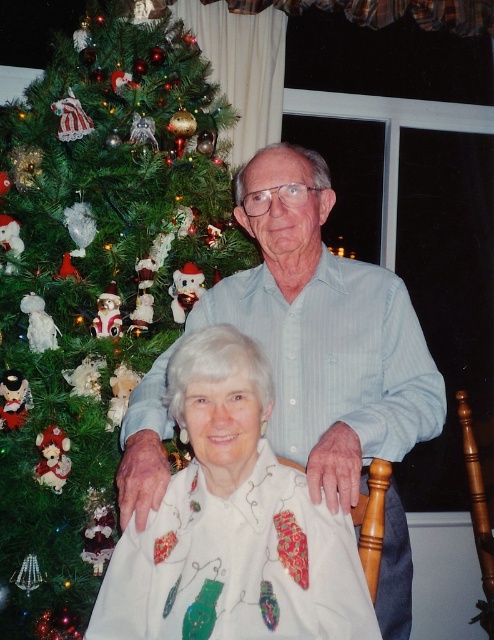
You are a photographer trying to capture a closeup of the white satin blouse at center without the green matte christmas tree at left blocking the view. Can you move the camera to the right side to achieve this?

The white satin blouse at center is behind the green matte christmas tree at left, so moving the camera to the right side might help avoid the tree blocking the view.

You are standing in front of the festive scene and want to place a gift box under the green matte christmas tree at left. If the gift box requires 3 feet of space, is there enough space available?

The distance between the green matte christmas tree at left and the viewer is 5.90 feet. Since the gift box requires 3 feet of space, there is sufficient space available to place it under the tree.